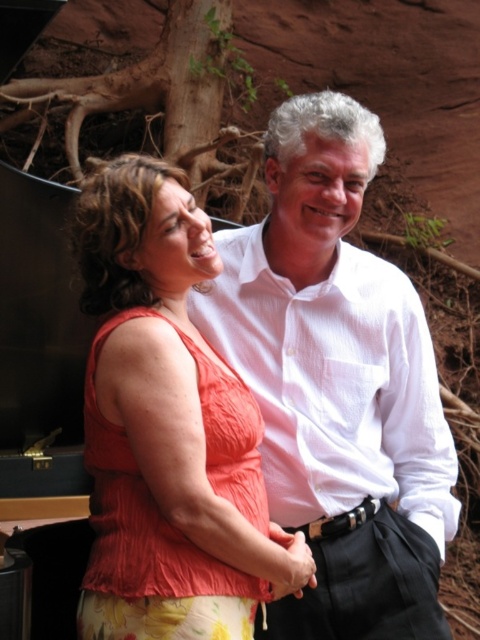
You are a photographer trying to capture the orange fabric top at center and the white textured shirt at center in a single frame. Which of the two items is positioned higher in the image?

The orange fabric top at center is positioned higher than the white textured shirt at center, so it will appear higher in the frame.

You are a photographer trying to capture the two people in the image. You want to ensure that the orange fabric top at center and the white textured shirt at center are both clearly visible in the frame. Based on their positions, which person should you focus on first to capture both in the shot?

The orange fabric top at center is to the left of the white textured shirt at center, so you should focus on the person wearing the orange fabric top at center first since they are positioned to the left and closer to the camera, ensuring both are in frame.

You are a photographer trying to capture a portrait of the two people in the image. The camera you are using has a depth of field that can focus clearly on objects within 18 inches of each other. Can both the orange fabric top at center and the white textured shirt at center be in focus simultaneously?

The orange fabric top at center is 20.35 inches away from the white textured shirt at center. Since the distance between them exceeds the camera lens depth of field range of 18 inches, they cannot both be in focus at the same time.